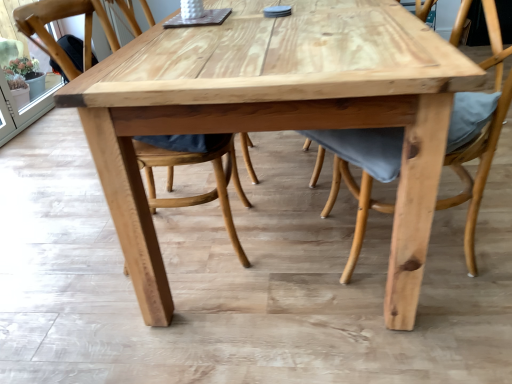
Where is `free space that is in between natural wood chair at center, the 1th chair from the left, and natural wood chair at center, placed as the 2th chair when sorted from left to right`? free space that is in between natural wood chair at center, the 1th chair from the left, and natural wood chair at center, placed as the 2th chair when sorted from left to right is located at coordinates coord(282,242).